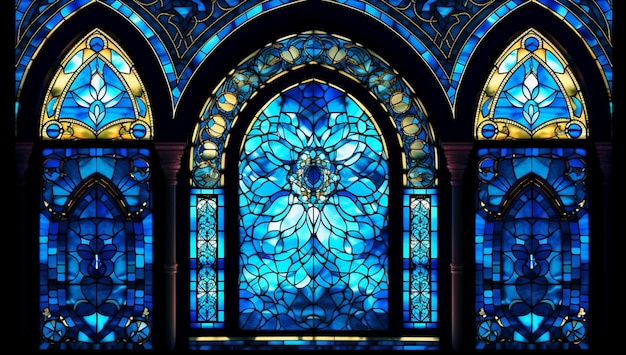
What are the coordinates of `brown top part column left side` in the screenshot? It's located at pos(171,149).